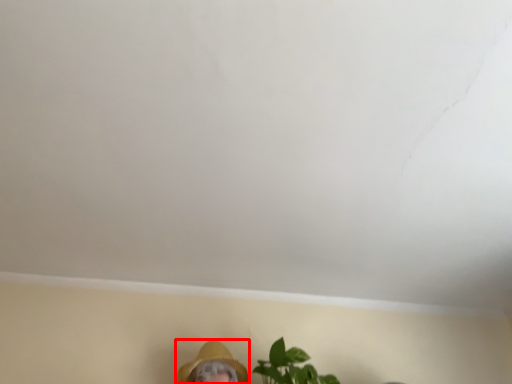
Question: From the image's perspective, what is the correct spatial relationship of person (annotated by the red box) in relation to houseplant?

Choices:
 (A) above
 (B) below

Answer: (B)